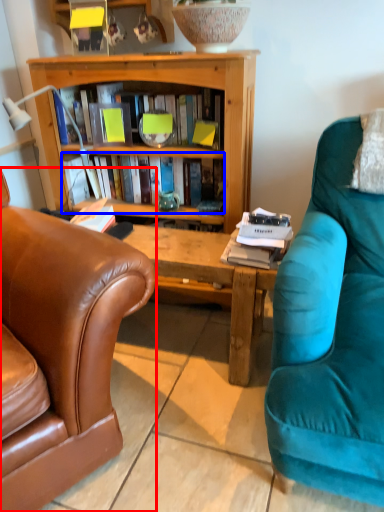
Question: Which object is further to the camera taking this photo, chair (highlighted by a red box) or book (highlighted by a blue box)?

Choices:
 (A) chair
 (B) book

Answer: (B)